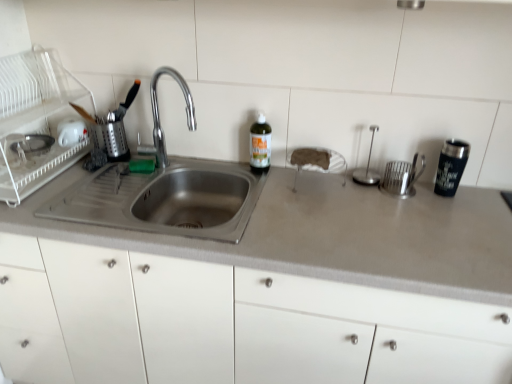
Question: Does stainless steel sink at left lie in front of green glass bottle at center?

Choices:
 (A) yes
 (B) no

Answer: (A)

Question: From the image's perspective, would you say stainless steel sink at left is positioned over green glass bottle at center?

Choices:
 (A) yes
 (B) no

Answer: (B)

Question: Is stainless steel sink at left to the right of green glass bottle at center from the viewer's perspective?

Choices:
 (A) no
 (B) yes

Answer: (A)

Question: Can you confirm if stainless steel sink at left is positioned to the left of green glass bottle at center?

Choices:
 (A) yes
 (B) no

Answer: (A)

Question: From a real-world perspective, does stainless steel sink at left sit lower than green glass bottle at center?

Choices:
 (A) no
 (B) yes

Answer: (B)

Question: Is green glass bottle at center at the back of stainless steel sink at left?

Choices:
 (A) yes
 (B) no

Answer: (A)

Question: Considering the relative sizes of stainless steel sink at left and black stainless steel tumbler at right in the image provided, is stainless steel sink at left shorter than black stainless steel tumbler at right?

Choices:
 (A) no
 (B) yes

Answer: (A)

Question: Is black stainless steel tumbler at right completely or partially inside stainless steel sink at left?

Choices:
 (A) yes
 (B) no

Answer: (B)

Question: Can you confirm if stainless steel sink at left is positioned to the left of black stainless steel tumbler at right?

Choices:
 (A) yes
 (B) no

Answer: (A)

Question: From a real-world perspective, does stainless steel sink at left stand above black stainless steel tumbler at right?

Choices:
 (A) yes
 (B) no

Answer: (A)

Question: Can you confirm if stainless steel sink at left is bigger than black stainless steel tumbler at right?

Choices:
 (A) no
 (B) yes

Answer: (B)

Question: Is stainless steel sink at left oriented towards black stainless steel tumbler at right?

Choices:
 (A) yes
 (B) no

Answer: (B)

Question: Is white matte sponge at center, which is counted as the third appliance, starting from the left, taller than black stainless steel tumbler at right?

Choices:
 (A) yes
 (B) no

Answer: (B)